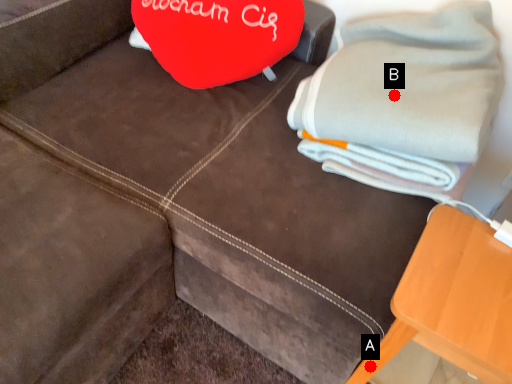
Question: Two points are circled on the image, labeled by A and B beside each circle. Which of the following is the closest to the observer?

Choices:
 (A) A is closer
 (B) B is closer

Answer: (A)